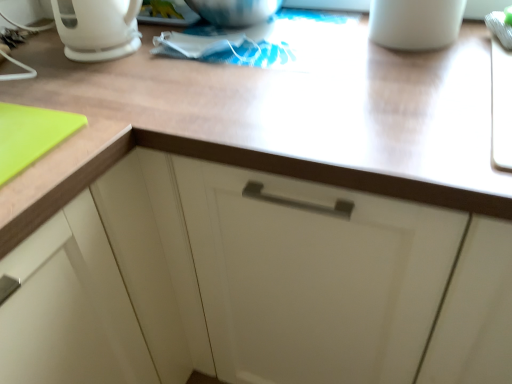
In order to face white matte mug at upper right, should I rotate leftwards or rightwards?

A 21.439 degree turn to the right will do.

Measure the distance between point (93, 3) and camera.

Point (93, 3) and camera are 31.73 inches apart.

You are a GUI agent. You are given a task and a screenshot of the screen. Output one action in this format:
    pyautogui.click(x=<x>, y=<y>)
    Task: Click on the wooden at upper center
    
    Given the screenshot: What is the action you would take?
    pyautogui.click(x=270, y=124)

From a real-world perspective, is wooden at upper center beneath white glossy coffee pot at upper left?

Yes, from a real-world perspective, wooden at upper center is beneath white glossy coffee pot at upper left.

Considering the relative sizes of wooden at upper center and white glossy coffee pot at upper left in the image provided, is wooden at upper center wider than white glossy coffee pot at upper left?

Yes.

In the scene shown: Can we say wooden at upper center lies outside white glossy coffee pot at upper left?

Absolutely, wooden at upper center is external to white glossy coffee pot at upper left.

Considering the relative sizes of white matte mug at upper right and wooden at upper center in the image provided, is white matte mug at upper right smaller than wooden at upper center?

Indeed, white matte mug at upper right has a smaller size compared to wooden at upper center.

Can we say white matte mug at upper right lies outside wooden at upper center?

Yes, white matte mug at upper right is located beyond the bounds of wooden at upper center.

Is white matte mug at upper right far away from wooden at upper center?

No, white matte mug at upper right is not far away from wooden at upper center.

Considering the positions of objects wooden at upper center and white matte mug at upper right in the image provided, who is in front, wooden at upper center or white matte mug at upper right?

wooden at upper center is closer to the camera.

From the image's perspective, is wooden at upper center on white matte mug at upper right?

No, from the image's perspective, wooden at upper center is not on top of white matte mug at upper right.

Considering the relative sizes of wooden at upper center and white matte mug at upper right in the image provided, is wooden at upper center smaller than white matte mug at upper right?

Actually, wooden at upper center might be larger than white matte mug at upper right.

Is wooden at upper center positioned far away from white matte mug at upper right?

No, wooden at upper center is not far from white matte mug at upper right.

From a real-world perspective, relative to white glossy coffee pot at upper left, is white matte mug at upper right vertically above or below?

Clearly, from a real-world perspective, white matte mug at upper right is below white glossy coffee pot at upper left.

What's the angular difference between white matte mug at upper right and white glossy coffee pot at upper left's facing directions?

The angular difference between white matte mug at upper right and white glossy coffee pot at upper left is 0.000694 degrees.

Could you tell me if white matte mug at upper right is turned towards white glossy coffee pot at upper left?

No, white matte mug at upper right does not turn towards white glossy coffee pot at upper left.

Does point (387, 37) come farther from viewer compared to point (109, 17)?

Yes, it is.

Based on their sizes in the image, would you say white glossy coffee pot at upper left is bigger or smaller than wooden at upper center?

white glossy coffee pot at upper left is smaller than wooden at upper center.

Is white glossy coffee pot at upper left to the left or to the right of wooden at upper center in the image?

Clearly, white glossy coffee pot at upper left is on the left of wooden at upper center in the image.

Locate an element on the screen. This screenshot has width=512, height=384. coffeepot above the wooden at upper center (from a real-world perspective) is located at coordinates (97, 28).

Which object is further away from the camera taking this photo, white glossy coffee pot at upper left or white matte mug at upper right?

Positioned behind is white glossy coffee pot at upper left.

Could you tell me if white glossy coffee pot at upper left is facing white matte mug at upper right?

No.

Considering the positions of points (109, 38) and (388, 13), is point (109, 38) closer to camera compared to point (388, 13)?

No, it is not.

I want to click on coffeepot that is above the wooden at upper center (from a real-world perspective), so click(x=97, y=28).

This screenshot has width=512, height=384. I want to click on countertop below the white matte mug at upper right (from a real-world perspective), so click(270, 124).

Estimate the real-world distances between objects in this image. Which object is closer to white glossy coffee pot at upper left, white matte mug at upper right or wooden at upper center?

Based on the image, wooden at upper center appears to be nearer to white glossy coffee pot at upper left.

Based on their spatial positions, is wooden at upper center or white glossy coffee pot at upper left closer to white matte mug at upper right?

wooden at upper center is positioned closer to the anchor white matte mug at upper right.

When comparing their distances from white glossy coffee pot at upper left, does wooden at upper center or white matte mug at upper right seem further?

white matte mug at upper right lies further to white glossy coffee pot at upper left than the other object.

Based on their spatial positions, is white glossy coffee pot at upper left or wooden at upper center further from white matte mug at upper right?

Based on the image, white glossy coffee pot at upper left appears to be further to white matte mug at upper right.

Looking at the image, which one is located closer to wooden at upper center, white matte mug at upper right or white glossy coffee pot at upper left?

white matte mug at upper right lies closer to wooden at upper center than the other object.

Looking at this image, looking at the image, which one is located further to wooden at upper center, white glossy coffee pot at upper left or white matte mug at upper right?

white glossy coffee pot at upper left.

This screenshot has height=384, width=512. In order to click on countertop between white glossy coffee pot at upper left and white matte mug at upper right in this screenshot , I will do `click(270, 124)`.